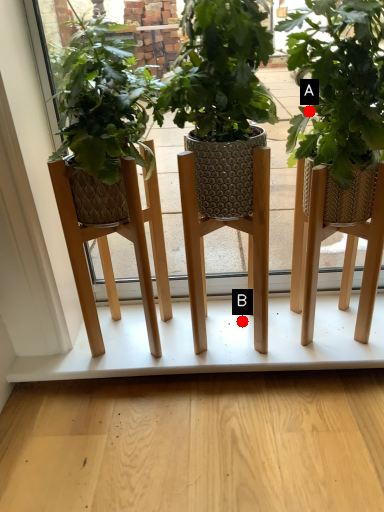
Question: Two points are circled on the image, labeled by A and B beside each circle. Which point is closer to the camera taking this photo?

Choices:
 (A) A is closer
 (B) B is closer

Answer: (A)